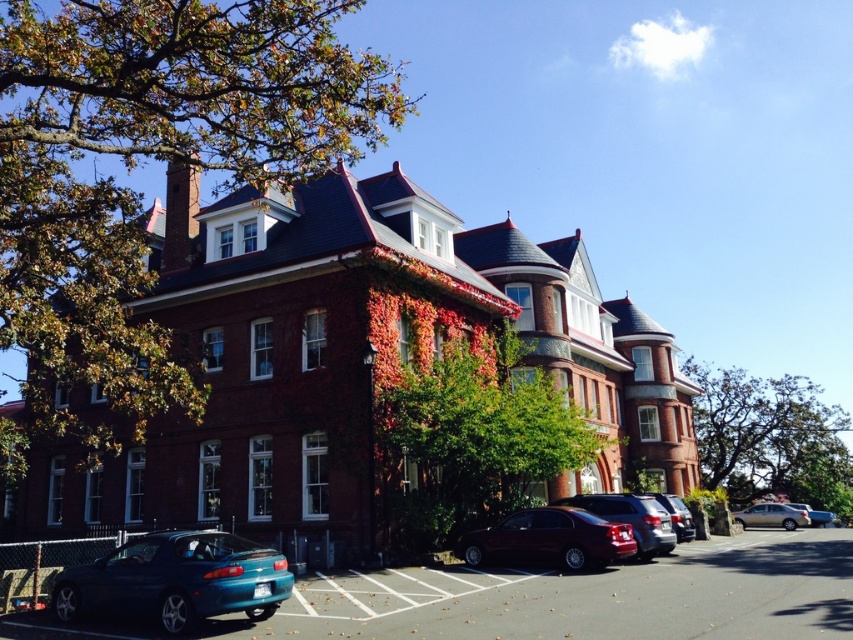
Which is in front, point (515, 474) or point (659, 516)?

Point (659, 516) is in front.

Consider the image. Does green leafy tree at center appear over shiny silver sedan at center?

Correct, green leafy tree at center is located above shiny silver sedan at center.

Is point (502, 385) positioned after point (670, 531)?

Yes.

The height and width of the screenshot is (640, 853). I want to click on green leafy tree at center, so click(474, 440).

Consider the image. Between green leafy tree at center and green leafy tree at right, which one has more height?

Standing taller between the two is green leafy tree at right.

Does green leafy tree at center come behind green leafy tree at right?

No, it is not.

Between point (422, 454) and point (836, 404), which one is positioned in front?

Point (422, 454) is in front.

This screenshot has height=640, width=853. Identify the location of green leafy tree at center. (474, 440).

Is point (676, 506) positioned before point (833, 516)?

Yes, it is.

Does satin silver sedan at center have a lesser width compared to metallic silver sedan at lower right?

Correct, satin silver sedan at center's width is less than metallic silver sedan at lower right's.

Locate an element on the screen. This screenshot has width=853, height=640. satin silver sedan at center is located at coordinates (676, 515).